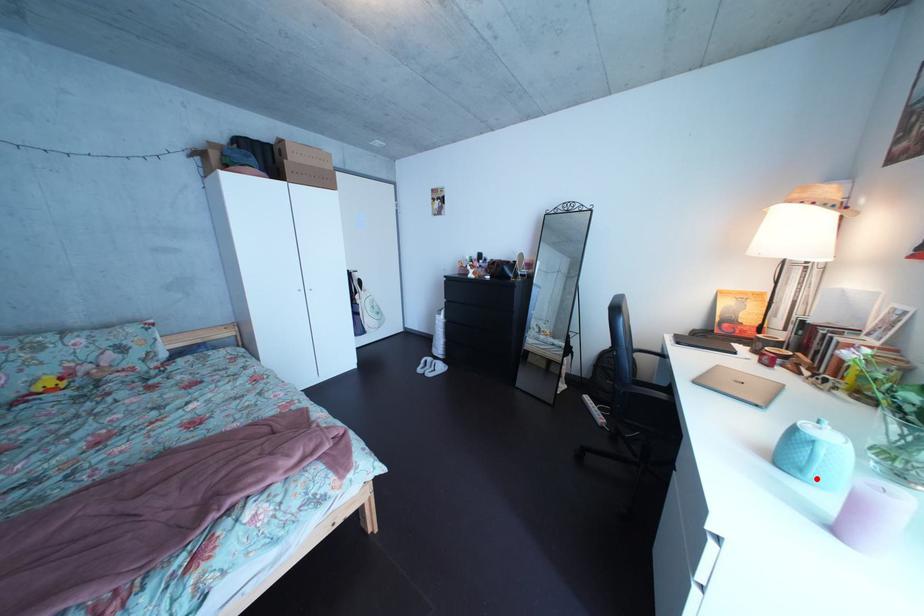
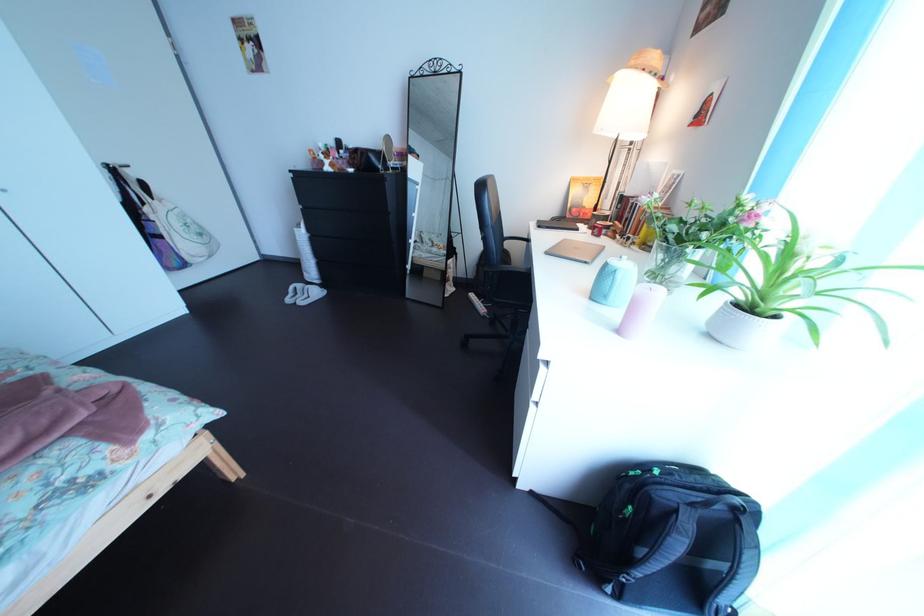
Question: A red point is marked in image1. In image2, is the corresponding 3D point closer to the camera or farther? Reply with the corresponding letter.

Choices:
 (A) The corresponding 3D point is closer.
 (B) The corresponding 3D point is farther.

Answer: (A)